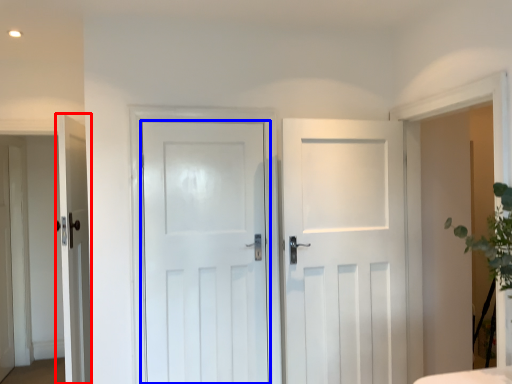
Question: Which object appears farthest to the camera in this image, door (highlighted by a red box) or door (highlighted by a blue box)?

Choices:
 (A) door
 (B) door

Answer: (B)